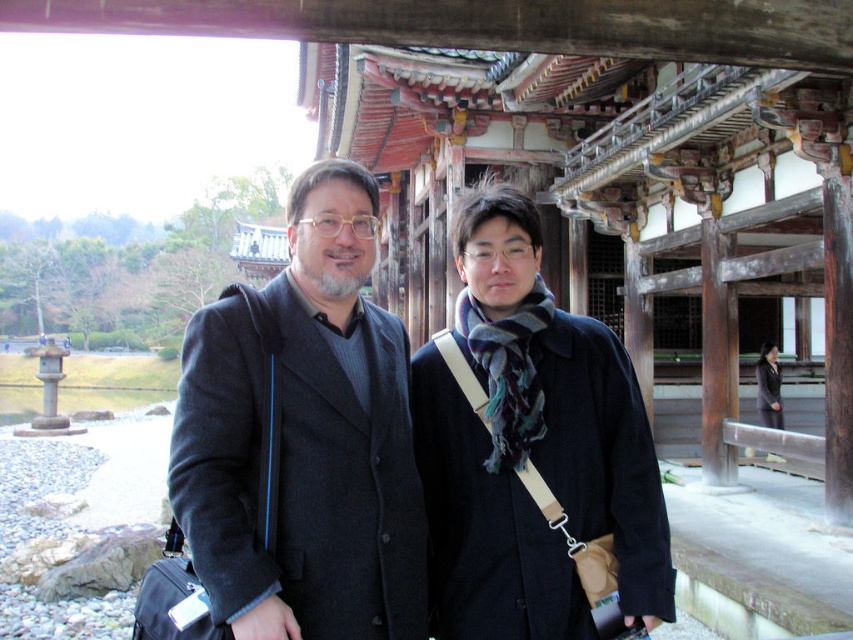
You are a fashion designer observing two coats in an image of a temple scene. The coats are the dark gray wool coat at center and the black fabric coat at right. Which coat appears taller?

The dark gray wool coat at center appears taller than the black fabric coat at right according to the description.

You are standing in front of the traditional Japanese building and want to move from the point at coordinates point (x=251, y=419) to the point at coordinates point (x=776, y=390). Which direction should you move in relation to the building?

You should move backward in relation to the building because point (x=251, y=419) is in front of point (x=776, y=390), so moving from the former to the latter requires moving away from the building.

You are a tourist visiting the temple and want to take a photo of the dark gray wool coat at center. Where should you stand to capture it in the best possible view?

The dark gray wool coat at center is located at point [305,436], so you should position yourself directly in front of this coordinate to capture it clearly.